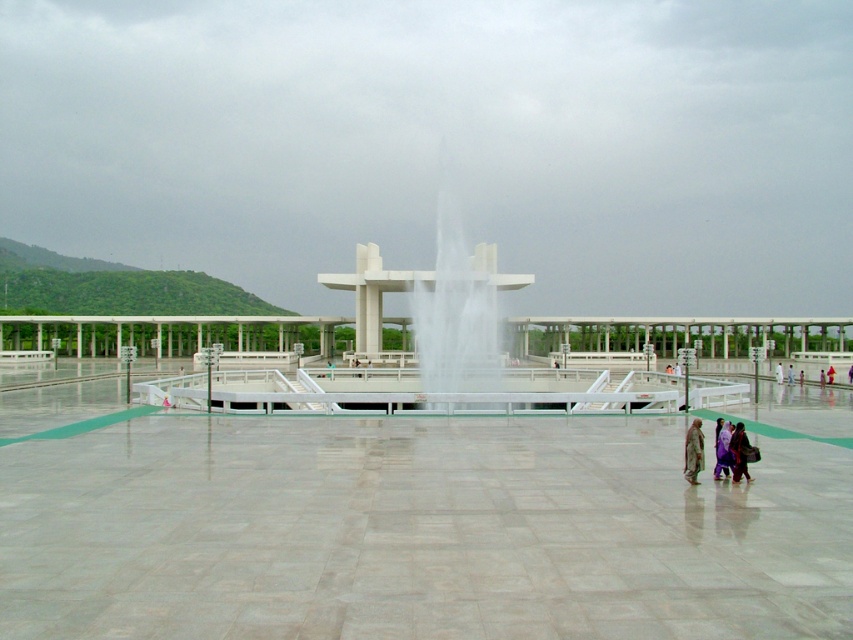
You are standing in the plaza and see the white cloth at center and the white fabric person at center. Which object is smaller in size?

The white cloth at center is smaller in size compared to the white fabric person at center.

You are standing in the plaza and want to take a photo of the purple fabric at center and the white cloth at center. Which one is closer to you?

The purple fabric at center is closer to you because it is in front of the white cloth at center.

Based on the photo, you are standing in the plaza and see the white cloth at center and the white fabric person at center. Which object is located to the left of the other?

The white cloth at center is positioned on the left side of white fabric person at center.